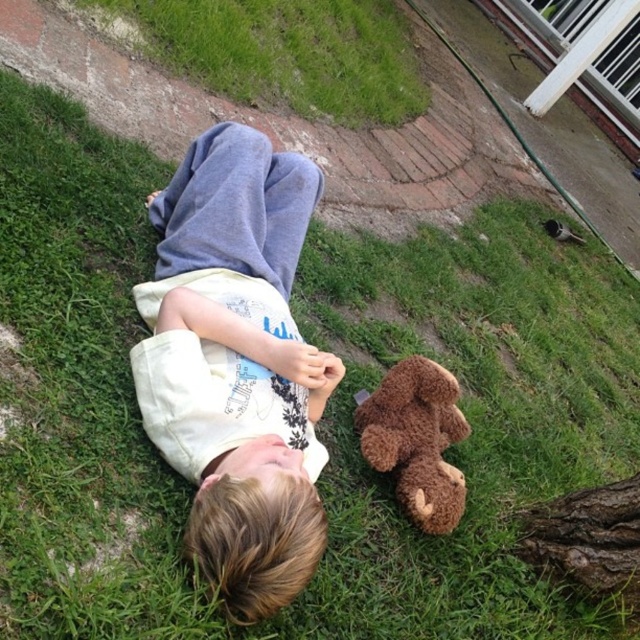
Question: Which point is farther to the camera?

Choices:
 (A) black fuzzy bird at upper right
 (B) brown plush teddy bear at lower center

Answer: (A)

Question: Among these objects, which one is farthest from the camera?

Choices:
 (A) brown plush teddy bear at lower center
 (B) black fuzzy bird at upper right
 (C) green grass at upper left

Answer: (B)

Question: From the image, what is the correct spatial relationship of green grass at upper left in relation to brown plush teddy bear at lower center?

Choices:
 (A) left
 (B) right

Answer: (A)

Question: Which of the following is the closest to the observer?

Choices:
 (A) (224, 472)
 (B) (566, 232)
 (C) (364, 428)
 (D) (266, 51)

Answer: (A)

Question: Does white cotton shirt at center lie behind green grass at upper left?

Choices:
 (A) yes
 (B) no

Answer: (B)

Question: Can you confirm if white cotton shirt at center is wider than black fuzzy bird at upper right?

Choices:
 (A) no
 (B) yes

Answer: (B)